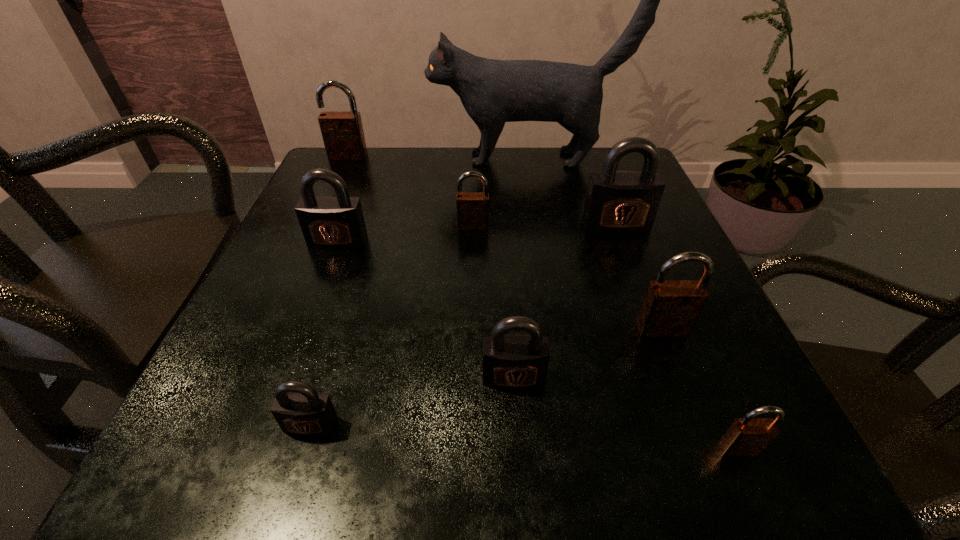
The width and height of the screenshot is (960, 540). I want to click on gray padlock that stands as the closest to the third gray padlock from left to right, so click(x=303, y=411).

Locate which brown padlock ranks third in proximity to the cat. Please provide its 2D coordinates. Your answer should be formatted as a tuple, i.e. [(x, y)], where the tuple contains the x and y coordinates of a point satisfying the conditions above.

[(670, 308)]

Identify which brown padlock is the third closest to the fourth nearest object. Please provide its 2D coordinates. Your answer should be formatted as a tuple, i.e. [(x, y)], where the tuple contains the x and y coordinates of a point satisfying the conditions above.

[(342, 131)]

Find the location of a particular element. This screenshot has height=540, width=960. vacant region that satisfies the following two spatial constraints: 1. at the face of the tallest object; 2. on the front of the third gray padlock from left to right near the keyhole is located at coordinates (564, 377).